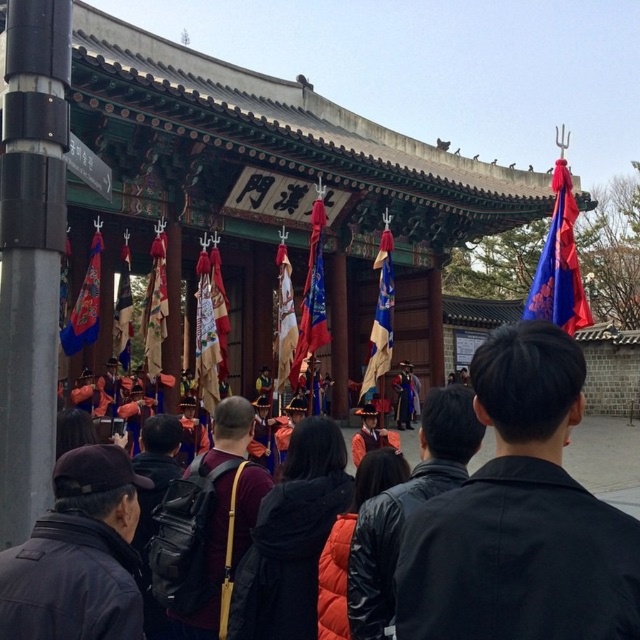
You are standing at the entrance of the traditional Korean building and see two points marked on the ground. One is labeled as point (13, 572) and the other as point (212, 625). Which point is closer to the building?

Point (13, 572) is in front of point (212, 625), so it is closer to the building.

Looking at this image, you are a tour guide leading a group to the entrance of the building. You notice a tourist is standing at the dark gray jacket at lower left and wants to reach the dark brown leather backpack at center to retrieve their belongings. Can they walk directly to the backpack without obstacles?

The distance between the dark gray jacket at lower left and the dark brown leather backpack at center is 7.09 meters. Since there are no mentioned obstacles in the scene description, the tourist can walk directly to the backpack.

You are a photographer standing in front of the traditional Korean building. You notice the dark gray jacket at lower left and the dark brown leather backpack at center. Which object is closer to the ground?

The dark gray jacket at lower left is located below the dark brown leather backpack at center, so it is closer to the ground.